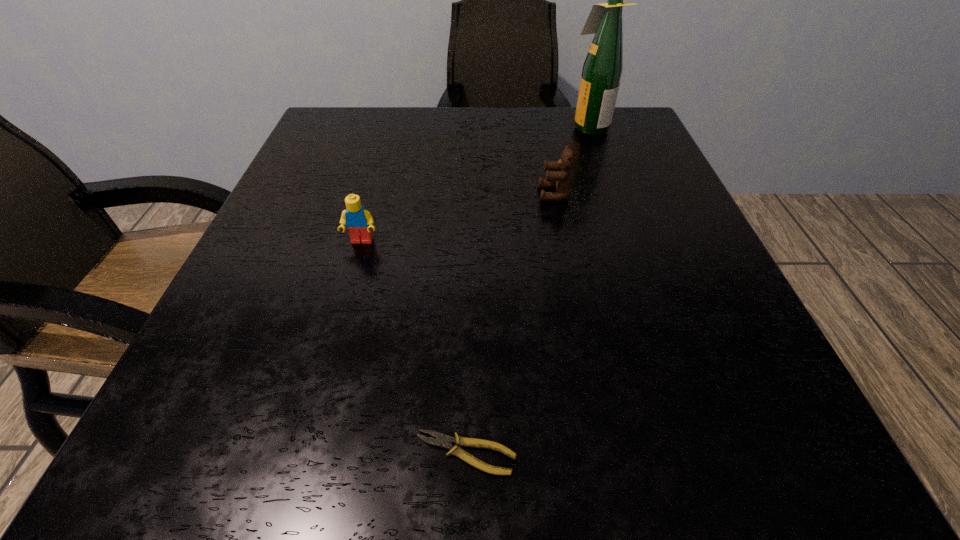
Locate an element on the screen. The width and height of the screenshot is (960, 540). liquor is located at coordinates (603, 66).

This screenshot has width=960, height=540. Identify the location of the rightmost object. (603, 66).

Locate an element on the screen. the third object from left to right is located at coordinates click(562, 181).

Locate an element on the screen. the third nearest object is located at coordinates (562, 181).

Find the location of `Lego`. Lego is located at coordinates 358,220.

Where is `the third farthest object`? This screenshot has height=540, width=960. the third farthest object is located at coordinates (358, 220).

Locate an element on the screen. The image size is (960, 540). the nearest object is located at coordinates (443, 441).

Image resolution: width=960 pixels, height=540 pixels. I want to click on the shortest object, so click(x=443, y=441).

Locate an element on the screen. Image resolution: width=960 pixels, height=540 pixels. free location located 0.140m on the front-facing side of the liquor is located at coordinates (508, 127).

This screenshot has height=540, width=960. What are the coordinates of `free space located on the front-facing side of the liquor` in the screenshot? It's located at (434, 127).